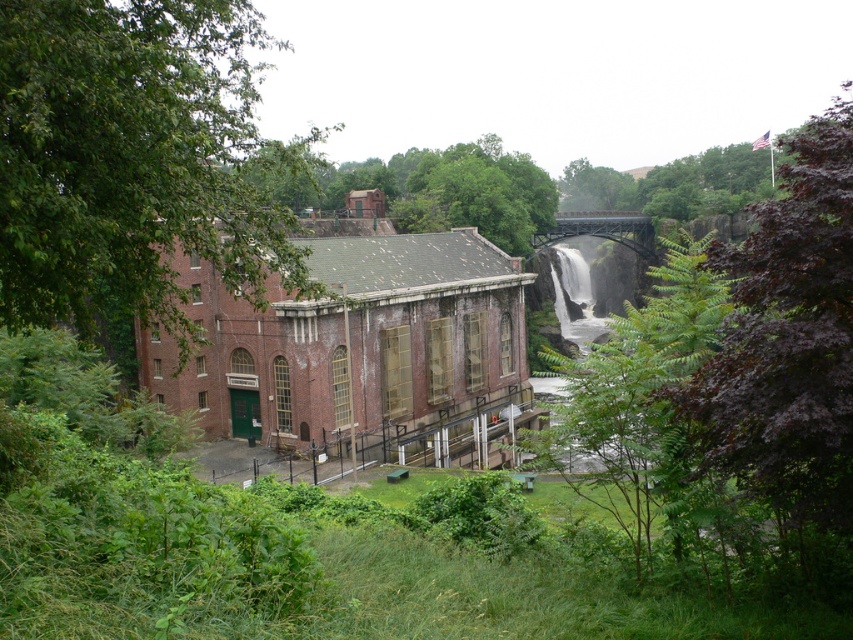
Does red brick building at center have a lesser width compared to purple leafy tree at upper right?

Indeed, red brick building at center has a lesser width compared to purple leafy tree at upper right.

Who is positioned more to the left, red brick building at center or purple leafy tree at upper right?

Positioned to the left is red brick building at center.

This screenshot has height=640, width=853. What are the coordinates of `red brick building at center` in the screenshot? It's located at (352, 342).

Can you confirm if green leafy tree at left is positioned to the left of purple leafy tree at upper right?

Yes, green leafy tree at left is to the left of purple leafy tree at upper right.

Is point (222, 216) positioned behind point (830, 262)?

That is True.

The height and width of the screenshot is (640, 853). What are the coordinates of `green leafy tree at left` in the screenshot? It's located at (134, 163).

Who is more distant from viewer, [57,177] or [286,371]?

Point [286,371]

I want to click on green leafy tree at left, so click(134, 163).